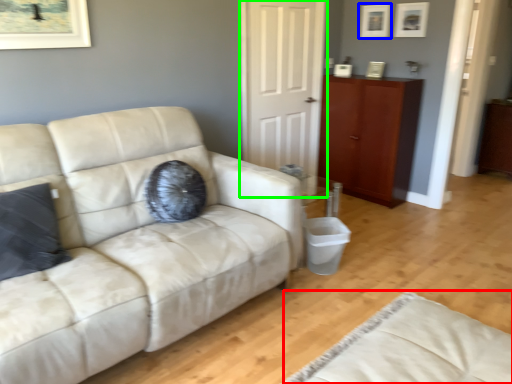
Question: Which is farther away from beige (highlighted by a red box)? picture frame (highlighted by a blue box) or door (highlighted by a green box)?

Choices:
 (A) picture frame
 (B) door

Answer: (A)